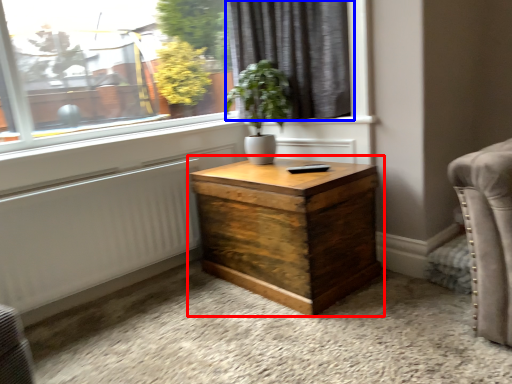
Question: Which of the following is the farthest to the observer, nightstand (highlighted by a red box) or curtain (highlighted by a blue box)?

Choices:
 (A) nightstand
 (B) curtain

Answer: (B)